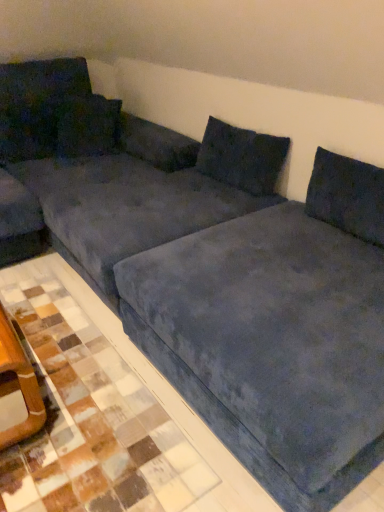
Where is `empty space that is ontop of blue suede tile at lower right`? The height and width of the screenshot is (512, 384). empty space that is ontop of blue suede tile at lower right is located at coordinates (52, 355).